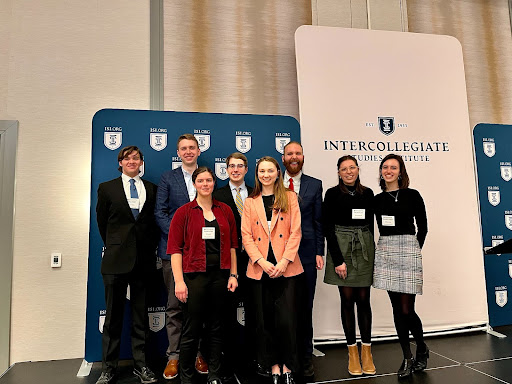
The height and width of the screenshot is (384, 512). Find the location of `grey wooden frames`. grey wooden frames is located at coordinates (159, 64), (8, 201), (5, 125).